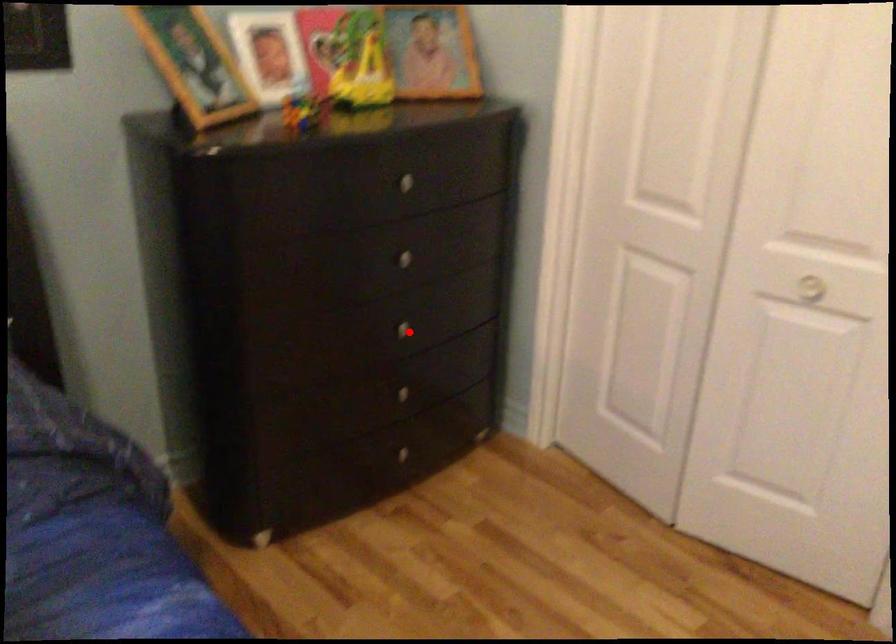
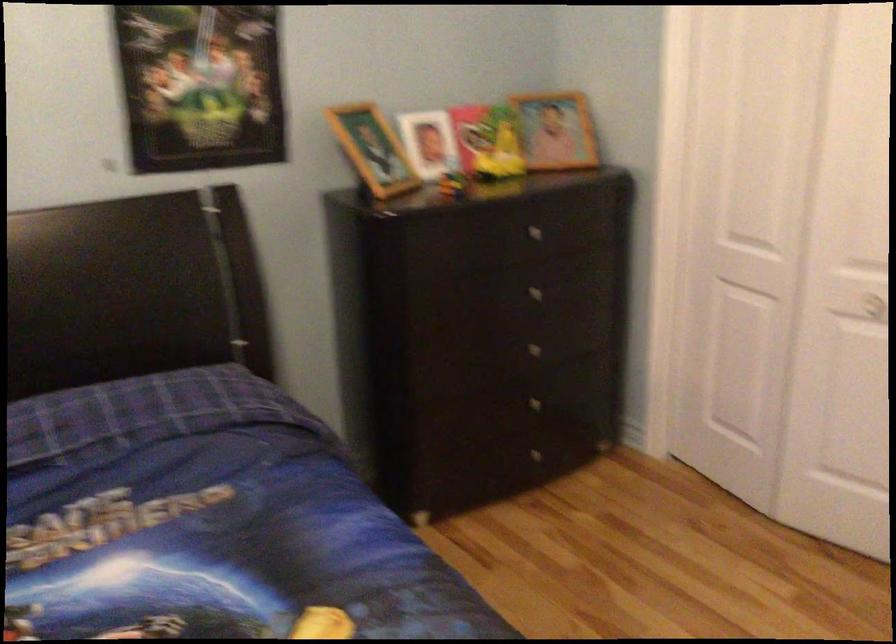
Find the pixel in the second image that matches the highlighted location in the first image.

(539, 353)